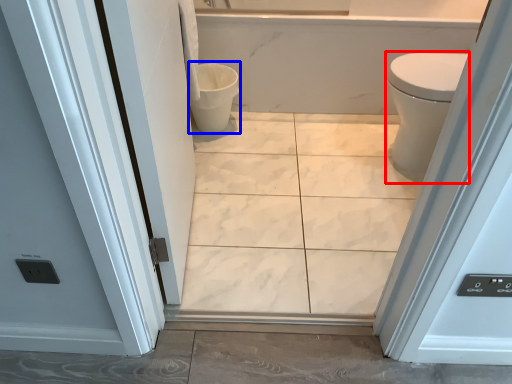
Question: Among these objects, which one is nearest to the camera, bidet (highlighted by a red box) or toilet bowl (highlighted by a blue box)?

Choices:
 (A) bidet
 (B) toilet bowl

Answer: (A)